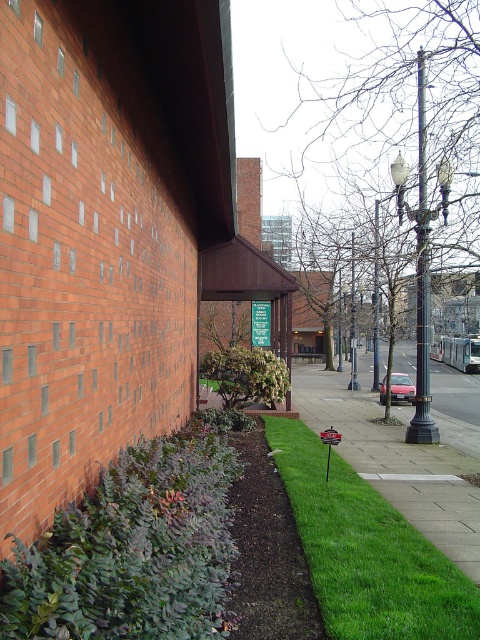
You are standing at the entrance of the brick building and want to walk to the point labeled as point (202, 369). There is an obstacle at point (67, 611). Will you have to go around the obstacle to reach your destination?

Since point (67, 611) is in front of point (202, 369), you will need to go around the obstacle at point (67, 611) to reach your destination.